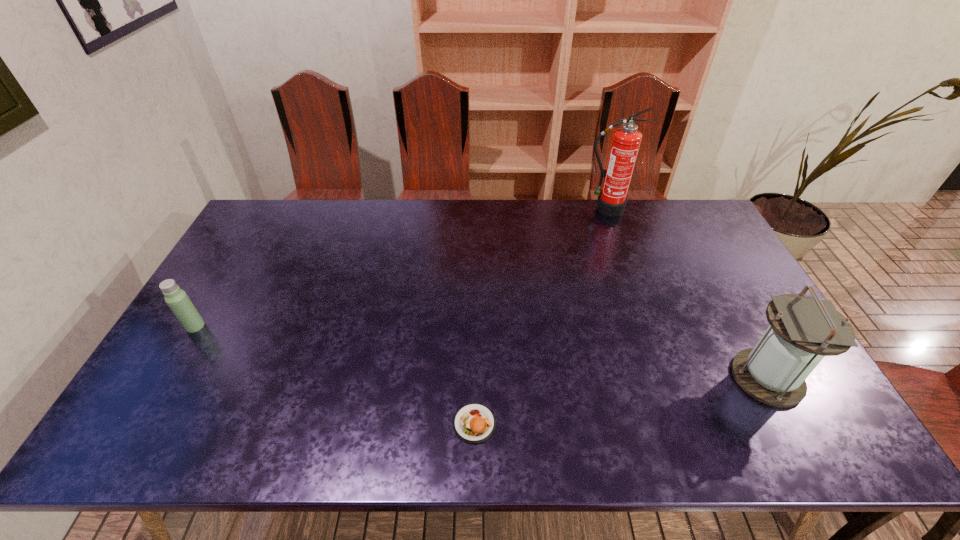
This screenshot has height=540, width=960. In order to click on vacant space positioned 0.350m on the right of the thermos bottle in this screenshot , I will do `click(328, 326)`.

Image resolution: width=960 pixels, height=540 pixels. In order to click on blank area located 0.170m on the left of the shortest object in this screenshot , I will do `click(380, 423)`.

Find the location of a particular element. Image resolution: width=960 pixels, height=540 pixels. object that is at the far edge is located at coordinates (626, 140).

Find the location of `object located at the near edge`. object located at the near edge is located at coordinates (474, 423).

Locate an element on the screen. object present at the left edge is located at coordinates (177, 299).

Locate an element on the screen. This screenshot has height=540, width=960. object positioned at the right edge is located at coordinates (803, 330).

At what (x,y) coordinates should I click in order to perform the action: click on blank space at the far edge of the desktop. Please return your answer as a coordinate pair (x, y). Looking at the image, I should click on (451, 231).

You are a GUI agent. You are given a task and a screenshot of the screen. Output one action in this format:
    pyautogui.click(x=<x>, y=<y>)
    Task: Click on the vacant region at the left edge of the desktop
    
    Given the screenshot: What is the action you would take?
    pyautogui.click(x=277, y=242)

Locate an element on the screen. Image resolution: width=960 pixels, height=540 pixels. free space at the right edge is located at coordinates (713, 270).

I want to click on free location at the far left corner of the desktop, so click(304, 200).